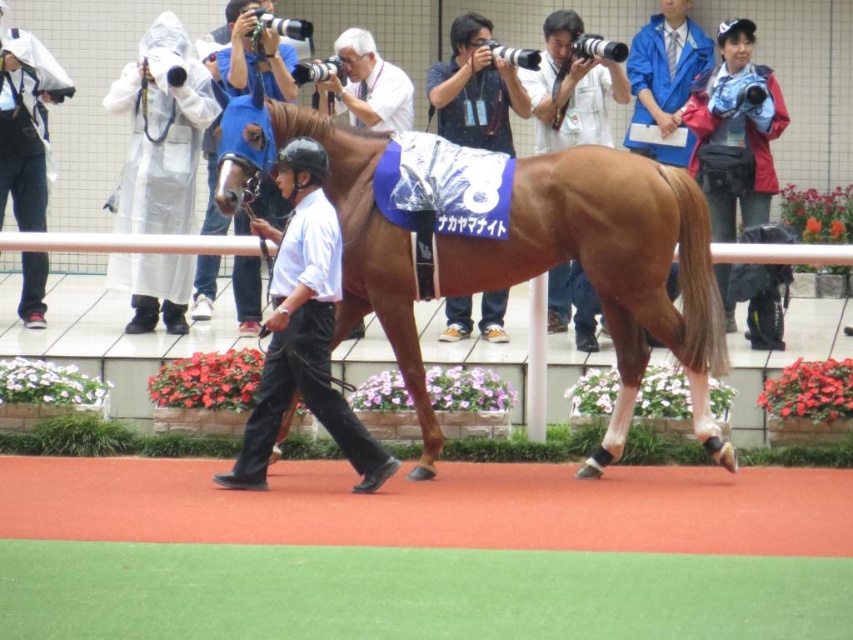
Is matte blue jersey at center behind blue fabric helmet at center?

Yes, matte blue jersey at center is further from the viewer.

Is matte blue jersey at center to the left of blue fabric helmet at center from the viewer's perspective?

No, matte blue jersey at center is not to the left of blue fabric helmet at center.

Is point (460, 336) closer to camera compared to point (294, 61)?

Yes, it is.

Find the location of a particular element. The width and height of the screenshot is (853, 640). matte blue jersey at center is located at coordinates (474, 88).

Is brown glossy horse at center above blue fabric helmet at center?

Actually, brown glossy horse at center is below blue fabric helmet at center.

Is brown glossy horse at center taller than blue fabric helmet at center?

Yes, brown glossy horse at center is taller than blue fabric helmet at center.

Between point (267, 99) and point (276, 61), which one is positioned in front?

Positioned in front is point (267, 99).

The image size is (853, 640). I want to click on brown glossy horse at center, so click(x=503, y=244).

Who is more forward, [305,211] or [637,60]?

Point [305,211]

Is matte white shirt at center shorter than blue fabric at upper right?

Incorrect, matte white shirt at center's height does not fall short of blue fabric at upper right's.

Is point (325, 236) less distant than point (675, 90)?

That is True.

In order to click on matte white shirt at center in this screenshot , I will do `click(303, 330)`.